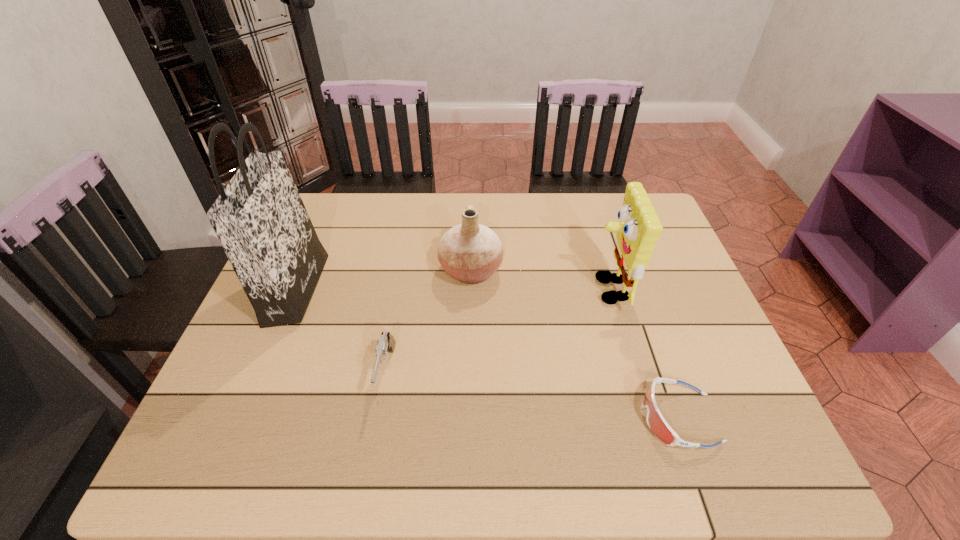
Image resolution: width=960 pixels, height=540 pixels. Identify the location of blank region between the tallest object and the gun. (341, 330).

Find the location of a particular element. Image resolution: width=960 pixels, height=540 pixels. empty space between the tallest object and the fourth shortest object is located at coordinates (452, 289).

Where is `free space between the shortest object and the second tallest object`? free space between the shortest object and the second tallest object is located at coordinates (643, 354).

What are the coordinates of `free space between the sponge and the second shortest object` in the screenshot? It's located at (497, 330).

Locate an element on the screen. The image size is (960, 540). vacant region between the leftmost object and the fourth shortest object is located at coordinates (452, 289).

The image size is (960, 540). What are the coordinates of `empty location between the third object from left to right and the gun` in the screenshot? It's located at (428, 321).

Image resolution: width=960 pixels, height=540 pixels. Find the location of `vacant point located between the pottery and the second tallest object`. vacant point located between the pottery and the second tallest object is located at coordinates (540, 280).

Select which object appears as the fourth closest to the goggles. Please provide its 2D coordinates. Your answer should be formatted as a tuple, i.e. [(x, y)], where the tuple contains the x and y coordinates of a point satisfying the conditions above.

[(259, 218)]

Locate an element on the screen. The height and width of the screenshot is (540, 960). the fourth closest object to the third tallest object is located at coordinates (656, 422).

Identify the location of vacant area in the image that satisfies the following two spatial constraints: 1. on the face of the second tallest object; 2. at the muzzle of the gun. Image resolution: width=960 pixels, height=540 pixels. (x=632, y=372).